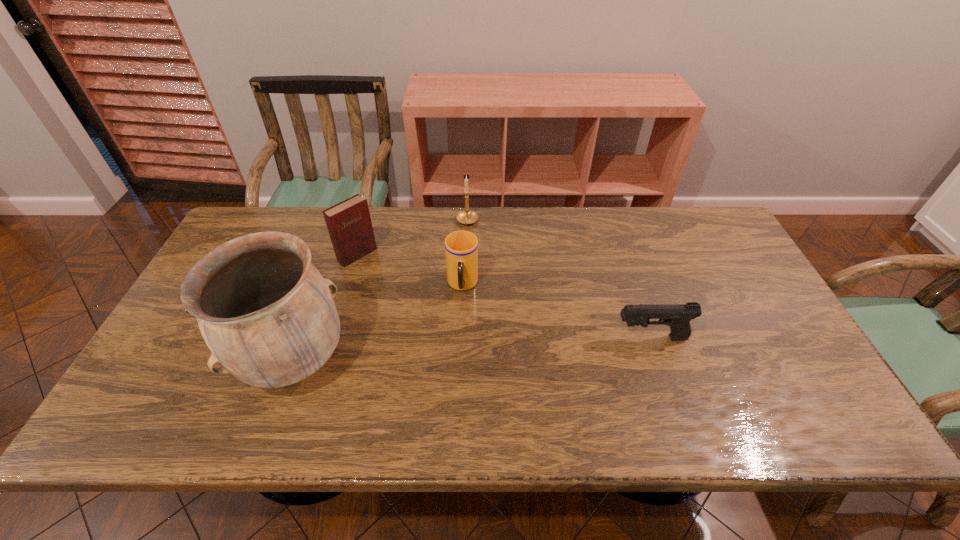
I want to click on the tallest object, so click(x=267, y=315).

Image resolution: width=960 pixels, height=540 pixels. I want to click on the rightmost object, so click(x=678, y=316).

Where is `the farthest object`? Image resolution: width=960 pixels, height=540 pixels. the farthest object is located at coordinates (467, 216).

Where is `diary`? This screenshot has width=960, height=540. diary is located at coordinates (349, 224).

You are a GUI agent. You are given a task and a screenshot of the screen. Output one action in this format:
    pyautogui.click(x=<x>, y=<y>)
    Task: Click on the cup
    Image resolution: width=960 pixels, height=540 pixels.
    Given the screenshot: What is the action you would take?
    click(461, 247)

Locate an element on the screen. This screenshot has width=960, height=540. vacant space located 0.300m on the back of the tallest object is located at coordinates (335, 246).

Locate an element on the screen. This screenshot has height=540, width=960. vacant space situated 0.220m at the barrel of the pistol is located at coordinates (529, 338).

Identify the location of blank space located 0.190m at the barrel of the pistol. The height and width of the screenshot is (540, 960). (540, 338).

Find the location of a particular element. vacant space located at the barrel of the pistol is located at coordinates (521, 338).

Identify the location of free location located on the handle side of the farthest object. This screenshot has height=540, width=960. [x=459, y=276].